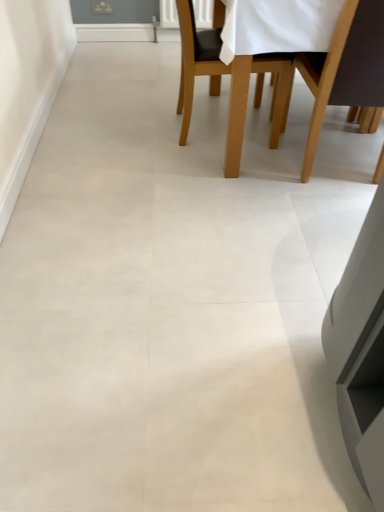
Question: Is brown wood chair at upper right, the first chair positioned from the right, wider or thinner than light brown wooden chair at upper center, which appears as the 1th chair when viewed from the left?

Choices:
 (A) thin
 (B) wide

Answer: (A)

Question: From the image's perspective, relative to light brown wooden chair at upper center, which appears as the 1th chair when viewed from the left, is brown wood chair at upper right, the first chair positioned from the right, above or below?

Choices:
 (A) below
 (B) above

Answer: (A)

Question: In terms of height, does brown wood chair at upper right, acting as the second chair starting from the left, look taller or shorter compared to light brown wooden chair at upper center, which appears as the 1th chair when viewed from the left?

Choices:
 (A) short
 (B) tall

Answer: (B)

Question: In the image, is light brown wooden chair at upper center, which appears as the 1th chair when viewed from the left, on the left side or the right side of brown wood chair at upper right, the first chair positioned from the right?

Choices:
 (A) right
 (B) left

Answer: (B)

Question: From the image's perspective, is light brown wooden chair at upper center, acting as the 2th chair starting from the right, positioned above or below brown wood chair at upper right, acting as the second chair starting from the left?

Choices:
 (A) below
 (B) above

Answer: (B)

Question: Is point (210, 72) positioned closer to the camera than point (359, 44)?

Choices:
 (A) closer
 (B) farther

Answer: (B)

Question: Is light brown wooden chair at upper center, acting as the 2th chair starting from the right, in front of or behind brown wood chair at upper right, acting as the second chair starting from the left, in the image?

Choices:
 (A) front
 (B) behind

Answer: (B)